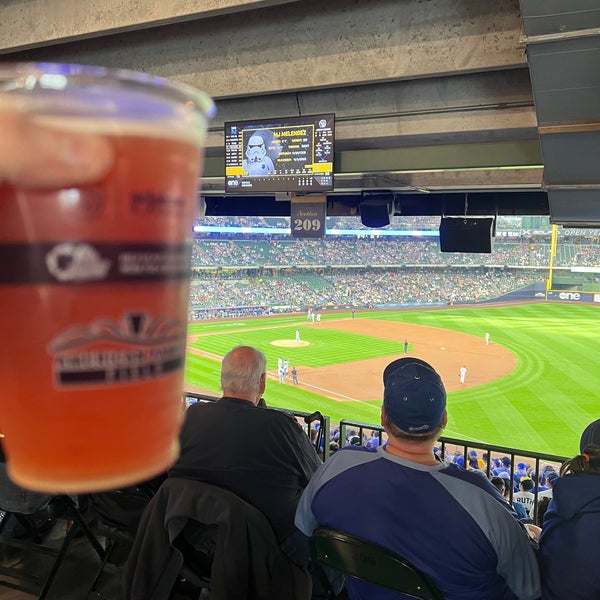
Locate an element on the screen. screen / monitor is located at coordinates (287, 155).